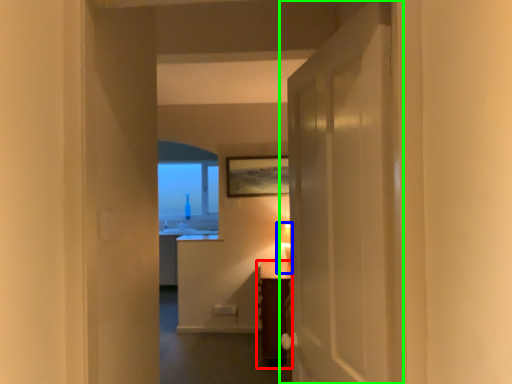
Question: Based on their relative distances, which object is nearer to furniture (highlighted by a red box)? Choose from table lamp (highlighted by a blue box) and door (highlighted by a green box).

Choices:
 (A) table lamp
 (B) door

Answer: (A)